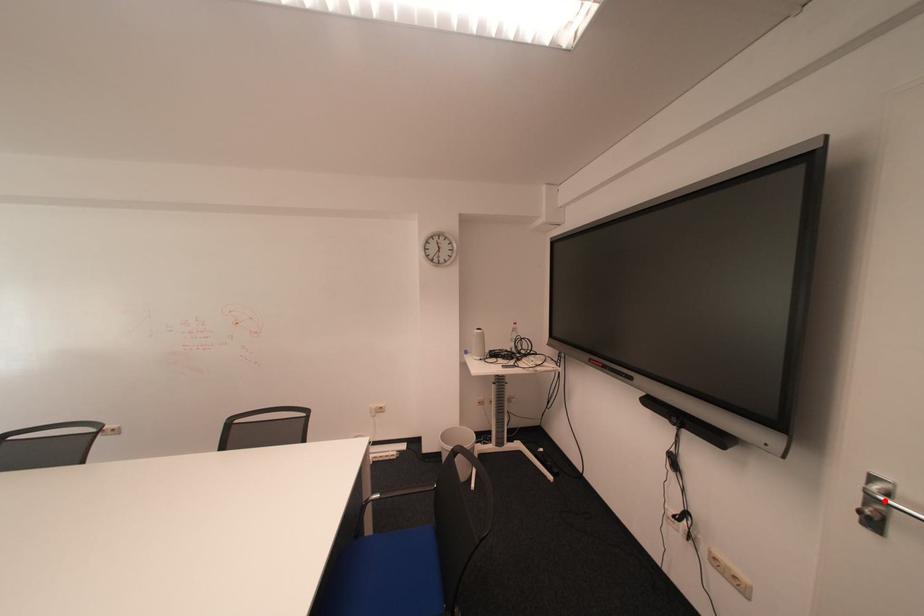
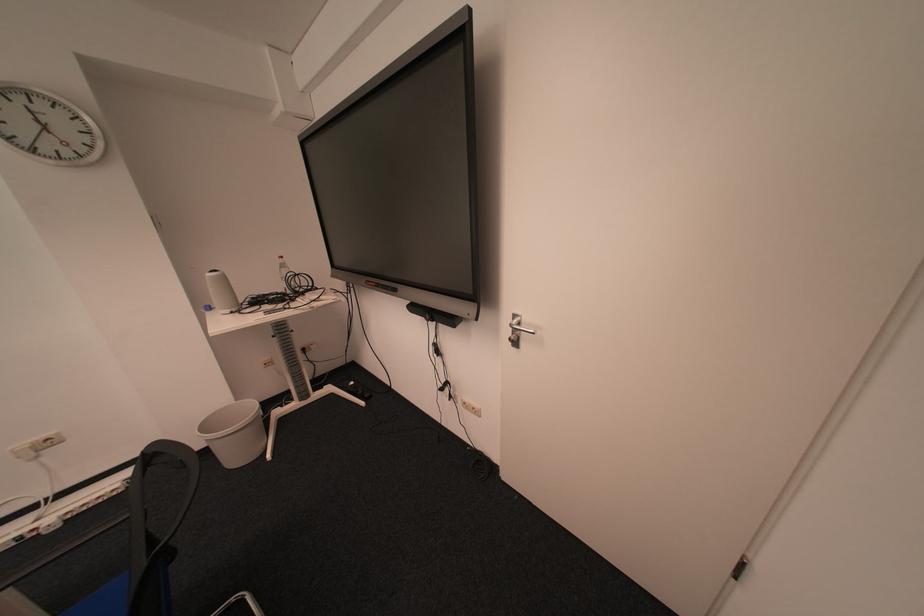
Where in the second image is the point corresponding to the highlighted location from the first image?

(525, 330)